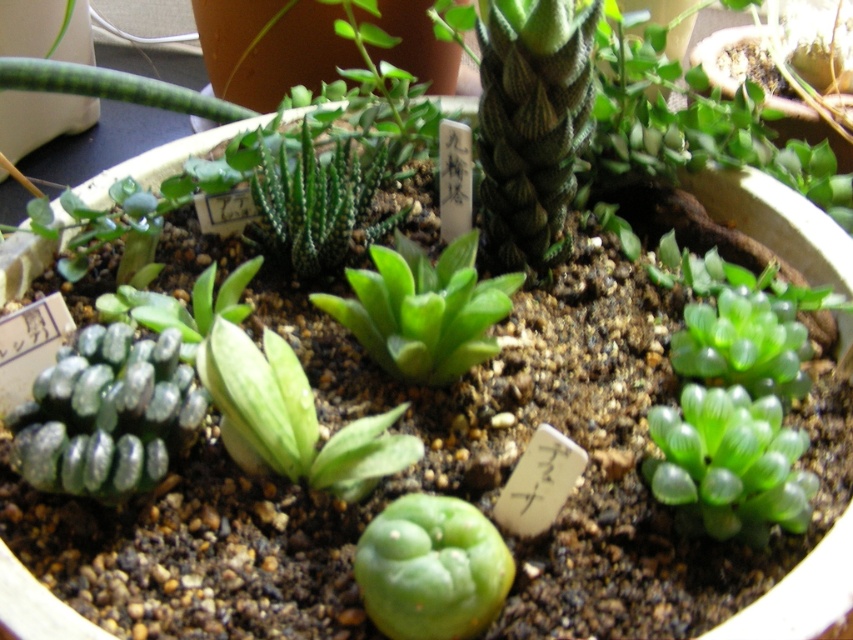
What object is located at the coordinates point (431, 568) in the image?

The point (431, 568) is located on the green matte glossy cactus at center.

You are a gardener who wants to place a small decorative stone between the green matte succulent at center and the green translucent succulent at center. The stone is 1 inch in diameter. Will there be enough space to fit the stone between them?

The green matte succulent at center is 3.62 inches from the green translucent succulent at center. Since the stone is only 1 inch in diameter, there is sufficient space to place it between them.